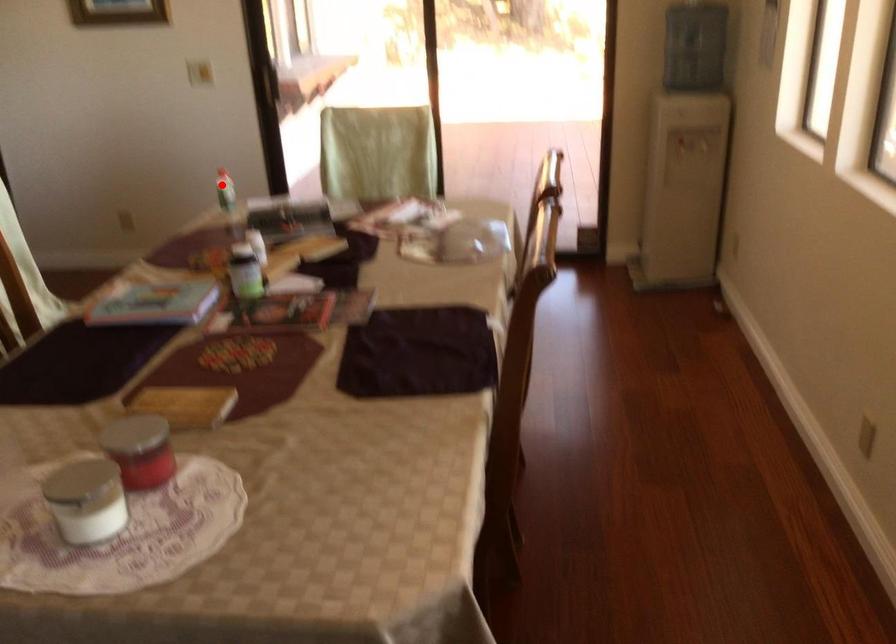
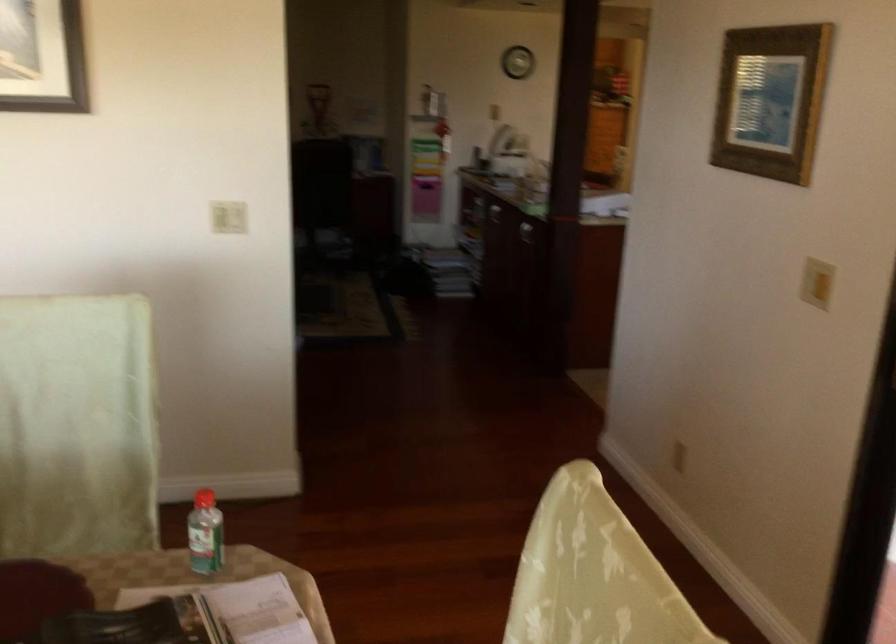
Question: I am providing you with two images of the same scene from different viewpoints. In image1, a red point is highlighted. Considering the same 3D point in image2, which of the following is correct?

Choices:
 (A) It is closer
 (B) It is farther

Answer: (A)